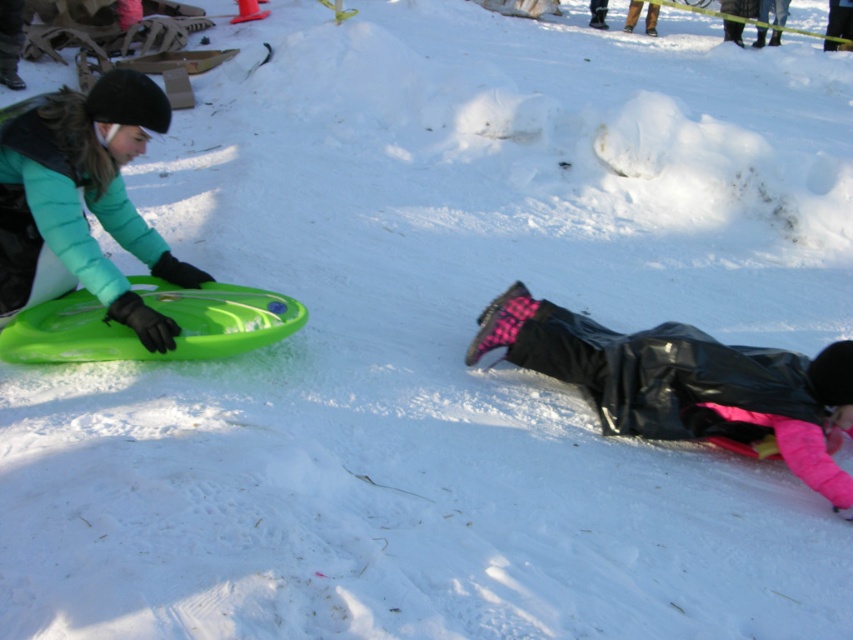
You are a parent watching your kids play in the snowy scene. You need to retrieve the green matte sled at left to put it away. Can you reach it from where you are standing near the black rubber pants at lower right without moving more than 2 meters?

The black rubber pants at lower right and green matte sled at left are 1.95 meters apart from each other. Since the distance is less than 2 meters, you can reach the green matte sled at left without moving more than 2 meters.

You are planning to take a photo of the black rubber pants at lower right and the green matte sled at left. Which object should you focus on first if you want to capture both in the same frame without adjusting your camera angle?

The black rubber pants at lower right has a lesser height compared to the green matte sled at left, so you should focus on the green matte sled at left first to ensure both are in frame.

You are a photographer trying to capture a photo of the black rubber pants at lower right and the green matte sled at left. Which object should you focus on first if you want to ensure both are in sharp focus?

The black rubber pants at lower right is in front of the green matte sled at left, so you should focus on the black rubber pants at lower right first to ensure both are in sharp focus.